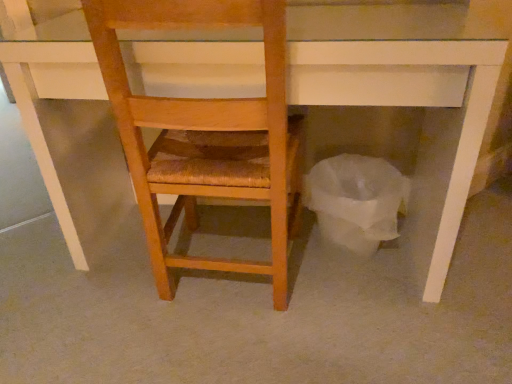
You are a GUI agent. You are given a task and a screenshot of the screen. Output one action in this format:
    pyautogui.click(x=<x>, y=<y>)
    Task: Click on the free point below wooden chair at center (from a real-world perspective)
    The image size is (512, 384).
    Given the screenshot: What is the action you would take?
    pyautogui.click(x=225, y=279)